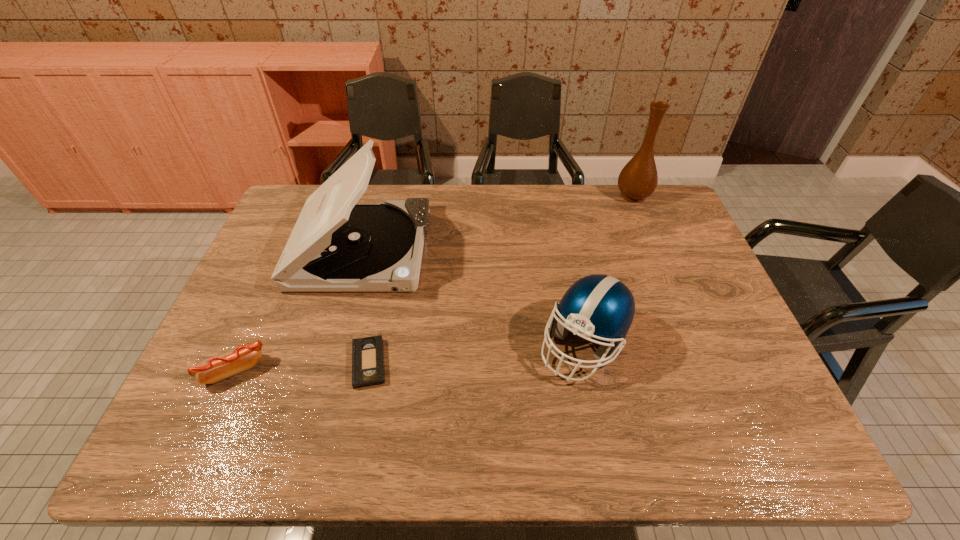
In the image, there is a desktop. Identify the location of free space at the near edge. This screenshot has height=540, width=960. (436, 439).

In order to click on free location at the left edge in this screenshot , I will do `click(272, 267)`.

Where is `free space between the shortest object and the football helmet`? This screenshot has height=540, width=960. free space between the shortest object and the football helmet is located at coordinates (476, 354).

Locate an element on the screen. This screenshot has width=960, height=540. free space between the sausage and the CD player is located at coordinates (298, 310).

This screenshot has height=540, width=960. I want to click on free spot between the fourth object from left to right and the rightmost object, so click(609, 270).

This screenshot has width=960, height=540. Identify the location of free space between the sausage and the rightmost object. (434, 283).

Find the location of a particular element. free space between the CD player and the farthest object is located at coordinates (497, 222).

In order to click on vacant space in between the shortest object and the sausage in this screenshot , I will do `click(301, 367)`.

Where is `free spot between the rightmost object and the fourth tallest object`? The width and height of the screenshot is (960, 540). free spot between the rightmost object and the fourth tallest object is located at coordinates (434, 283).

Where is `free area in between the shortest object and the second shortest object`? The width and height of the screenshot is (960, 540). free area in between the shortest object and the second shortest object is located at coordinates (301, 367).